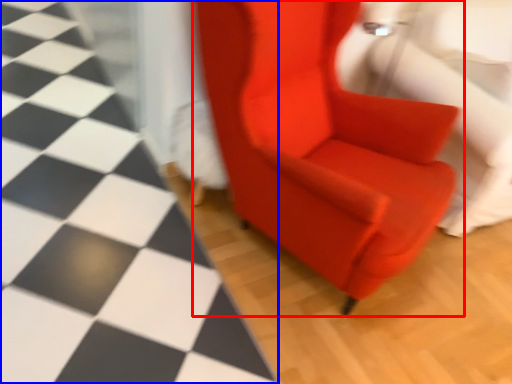
Question: Which object is closer to the camera taking this photo, chair (highlighted by a red box) or tile (highlighted by a blue box)?

Choices:
 (A) chair
 (B) tile

Answer: (B)